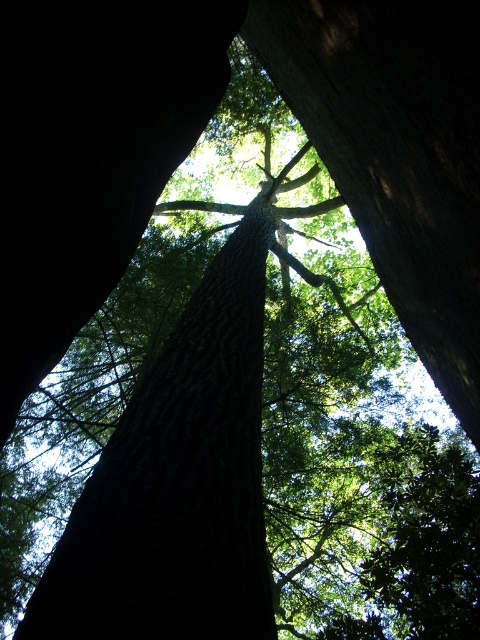
From the picture: Does dark brown rough tree trunk at center have a greater height compared to dark brown textured tree trunk at center?

No, dark brown rough tree trunk at center is not taller than dark brown textured tree trunk at center.

Between point (240, 324) and point (467, 419), which one is positioned behind?

The point (240, 324) is more distant.

Where is `dark brown rough tree trunk at center`? dark brown rough tree trunk at center is located at coordinates (178, 483).